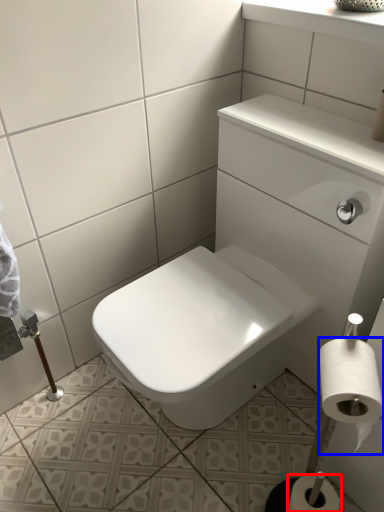
Question: Which object is closer to the camera taking this photo, toilet paper (highlighted by a red box) or toilet paper (highlighted by a blue box)?

Choices:
 (A) toilet paper
 (B) toilet paper

Answer: (B)